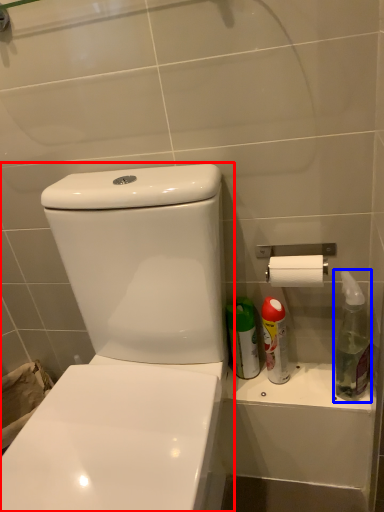
Question: Which object is further to the camera taking this photo, toilet (highlighted by a red box) or cleaning product (highlighted by a blue box)?

Choices:
 (A) toilet
 (B) cleaning product

Answer: (B)